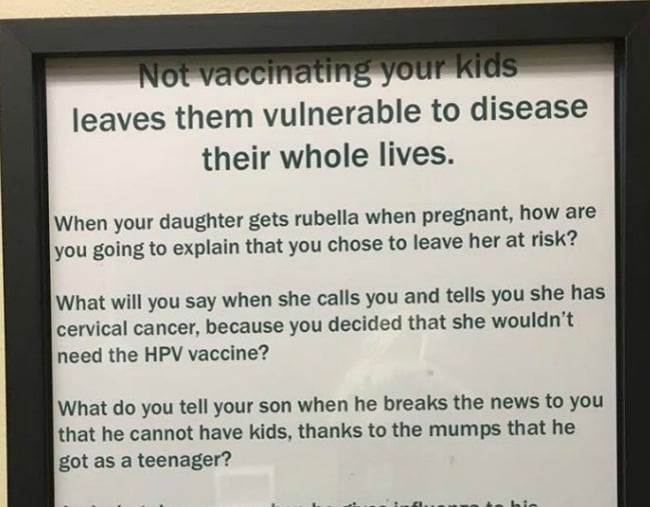
Find the location of a particular element. Image resolution: width=650 pixels, height=507 pixels. frame is located at coordinates (x=370, y=15).